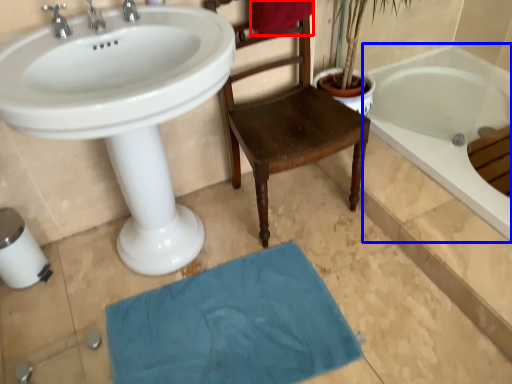
Question: Among these objects, which one is farthest to the camera, beach towel (highlighted by a red box) or bathtub (highlighted by a blue box)?

Choices:
 (A) beach towel
 (B) bathtub

Answer: (B)